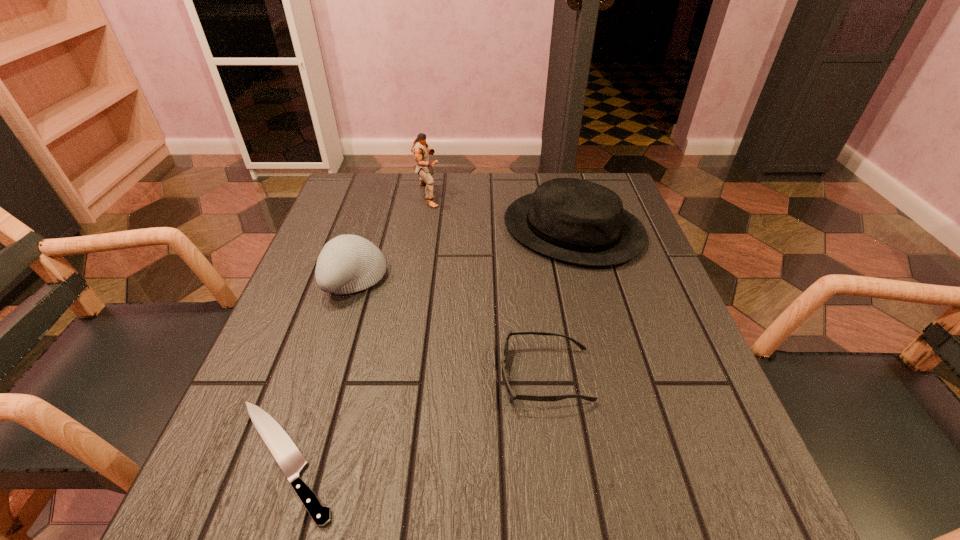
Locate an element on the screen. empty space that is in between the beanie and the fedora is located at coordinates (464, 254).

This screenshot has height=540, width=960. What are the coordinates of `free area in between the sunglasses and the puncher` in the screenshot? It's located at (488, 286).

The width and height of the screenshot is (960, 540). I want to click on unoccupied area between the shortest object and the beanie, so click(320, 369).

Where is `free space between the beanie and the fourth tallest object`? This screenshot has width=960, height=540. free space between the beanie and the fourth tallest object is located at coordinates (450, 327).

What are the coordinates of `free space that is in between the second shortest object and the steak knife` in the screenshot? It's located at (415, 417).

This screenshot has width=960, height=540. Identify the location of vacant area that lies between the beanie and the third object from right to left. (392, 237).

Select which object appears as the fourth closest to the beanie. Please provide its 2D coordinates. Your answer should be formatted as a tuple, i.e. [(x, y)], where the tuple contains the x and y coordinates of a point satisfying the conditions above.

[(573, 220)]

Identify the location of object that is the closest to the tallest object. (573, 220).

Locate an element on the screen. The height and width of the screenshot is (540, 960). free space that satisfies the following two spatial constraints: 1. on the front-facing side of the fedora; 2. on the right side of the puncher is located at coordinates (423, 230).

This screenshot has width=960, height=540. Find the location of `vacant space that satisfies the following two spatial constraints: 1. on the front-facing side of the puncher; 2. on the front side of the steak knife`. vacant space that satisfies the following two spatial constraints: 1. on the front-facing side of the puncher; 2. on the front side of the steak knife is located at coordinates (387, 459).